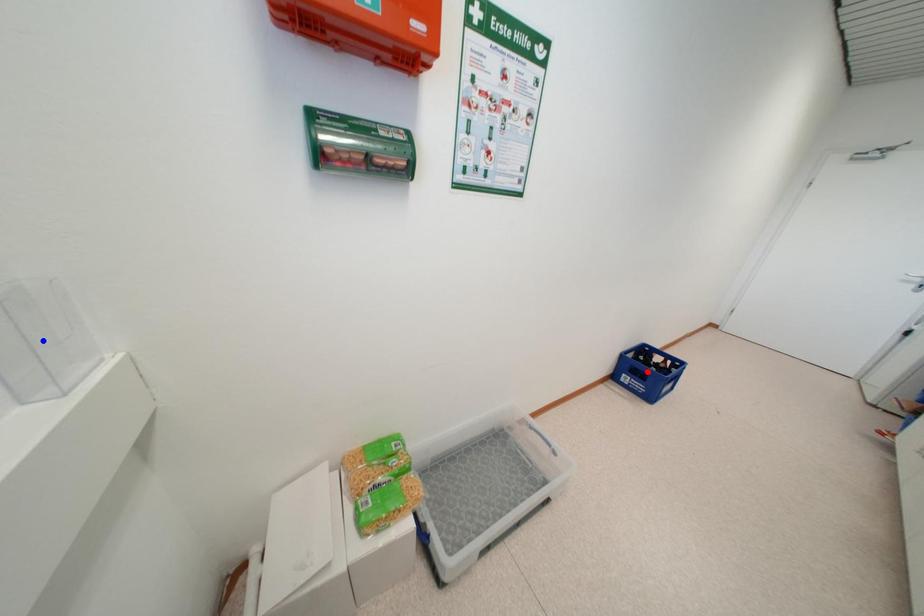
Question: Two points are marked on the image. Which point is closer to the camera?

Choices:
 (A) Blue point is closer.
 (B) Red point is closer.

Answer: (A)